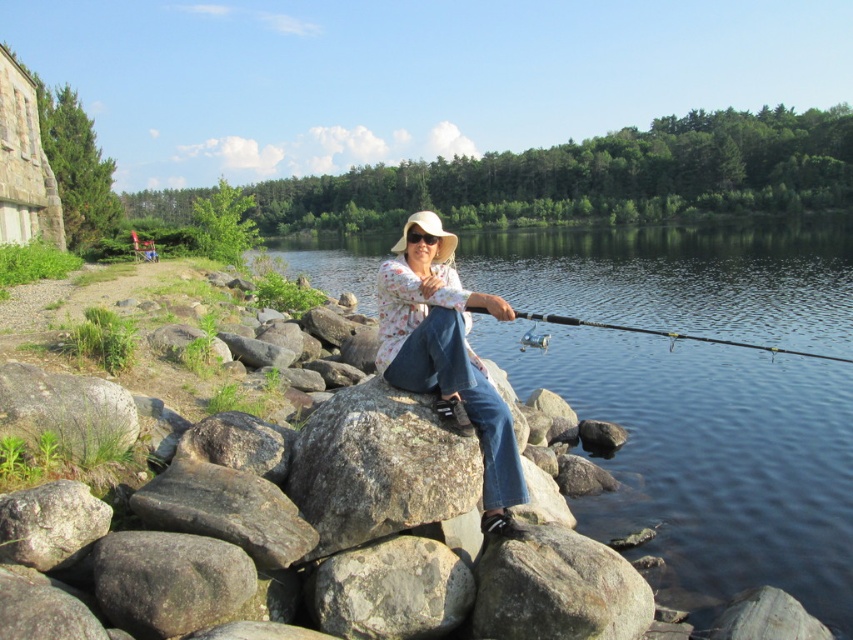
Is gray rough rock at center bigger than green grassy rock at lower left?

Incorrect, gray rough rock at center is not larger than green grassy rock at lower left.

Can you confirm if gray rough rock at center is positioned to the right of green grassy rock at lower left?

Yes, gray rough rock at center is to the right of green grassy rock at lower left.

Which is in front, point (404, 541) or point (27, 365)?

Point (404, 541) is more forward.

Locate an element on the screen. gray rough rock at center is located at coordinates (390, 589).

Does gray rough rock at lower center have a greater width compared to shiny metallic fishing pole at center?

Incorrect, gray rough rock at lower center's width does not surpass shiny metallic fishing pole at center's.

Consider the image. Can you confirm if gray rough rock at lower center is bigger than shiny metallic fishing pole at center?

Actually, gray rough rock at lower center might be smaller than shiny metallic fishing pole at center.

Who is more forward, (637,595) or (548,321)?

Point (637,595) is in front.

Find the location of a particular element. This screenshot has height=640, width=853. gray rough rock at lower center is located at coordinates (558, 589).

Who is shorter, clear water at center or shiny metallic fishing pole at center?

shiny metallic fishing pole at center

How far apart are clear water at center and shiny metallic fishing pole at center?

clear water at center is 34.61 meters from shiny metallic fishing pole at center.

The height and width of the screenshot is (640, 853). Describe the element at coordinates (709, 458) in the screenshot. I see `clear water at center` at that location.

Image resolution: width=853 pixels, height=640 pixels. I want to click on clear water at center, so click(x=709, y=458).